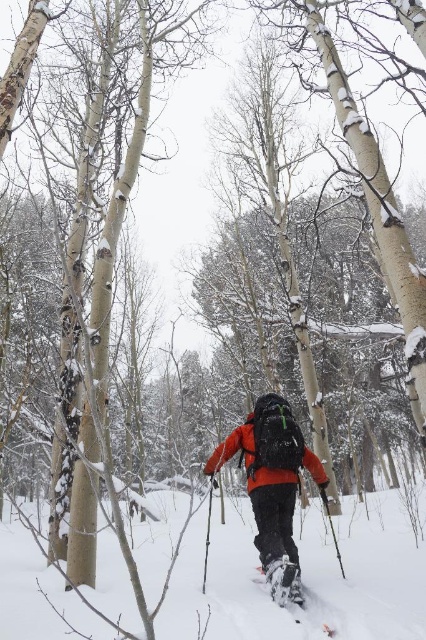
Does orange fleece jacket at center come in front of white matte ski at lower center?

That is False.

Can you confirm if orange fleece jacket at center is shorter than white matte ski at lower center?

No.

Consider the image. Who is more distant from viewer, (x=285, y=406) or (x=325, y=634)?

Positioned behind is point (x=285, y=406).

This screenshot has height=640, width=426. Find the location of `orange fleece jacket at center`. orange fleece jacket at center is located at coordinates (268, 445).

Does black plastic ski pole at center lie behind white matte ski at lower center?

That is True.

Find the location of a particular element. Image resolution: width=426 pixels, height=640 pixels. black plastic ski pole at center is located at coordinates (207, 528).

Where is `black plastic ski pole at center`? This screenshot has height=640, width=426. black plastic ski pole at center is located at coordinates (207, 528).

Who is more distant from viewer, (336, 554) or (336, 634)?

The point (336, 554) is more distant.

In the scene shown: Is black textured ski pole at center further to the viewer compared to white matte ski at lower center?

Yes, black textured ski pole at center is further from the viewer.

Between point (330, 518) and point (331, 628), which one is positioned in front?

Point (331, 628)

Locate an element on the screen. The width and height of the screenshot is (426, 640). black textured ski pole at center is located at coordinates (331, 525).